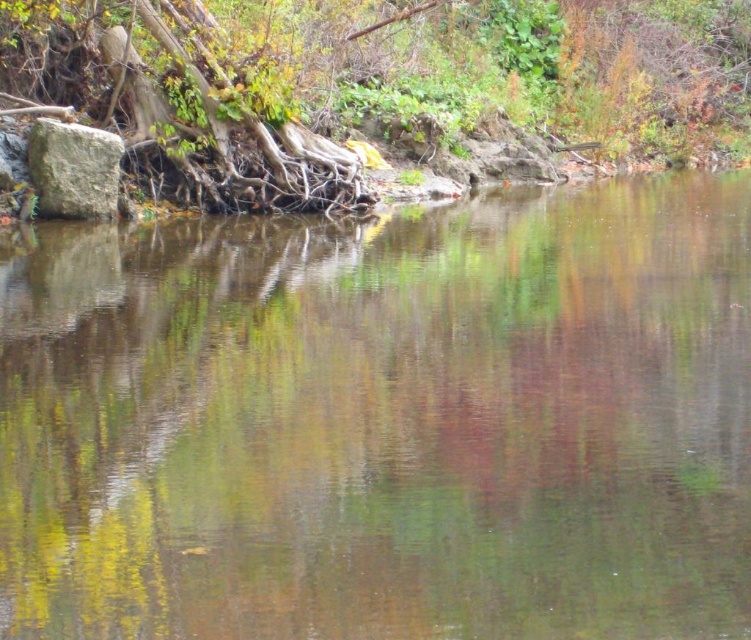
You are a small frog trying to jump from the smooth brown tree roots at left to the gray rough stone at left. Which one is easier to land on?

The smooth brown tree roots at left is smaller than the gray rough stone at left, so it might be harder to land on the smooth brown tree roots at left because it has less surface area for the frog to grip.

You are standing at the edge of the water and want to place a small decorative rock between the smooth brown tree roots at left and the gray rough stone at left. Which object should you place it closer to if you want it to be closer to you?

You should place the small decorative rock closer to the smooth brown tree roots at left because it is closer to you than the gray rough stone at left.